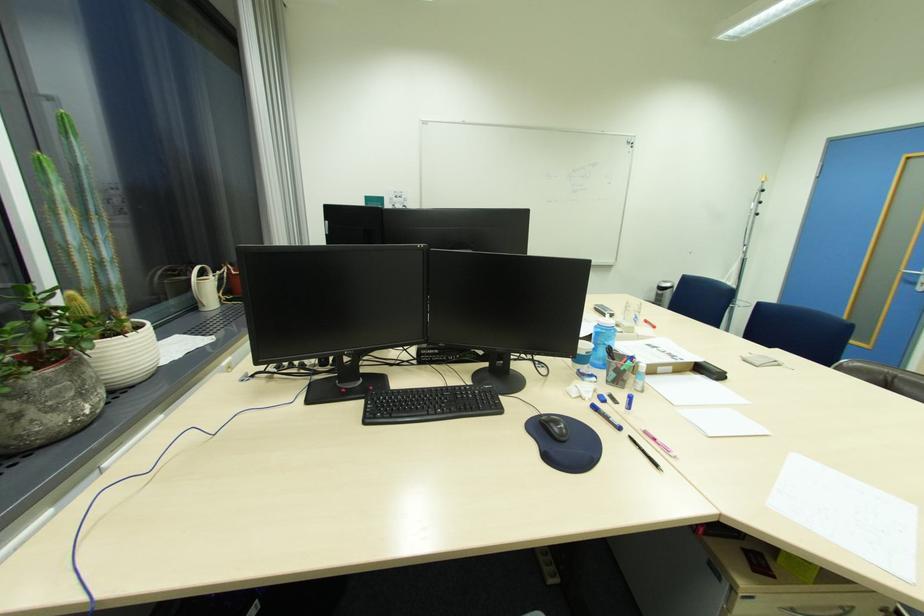
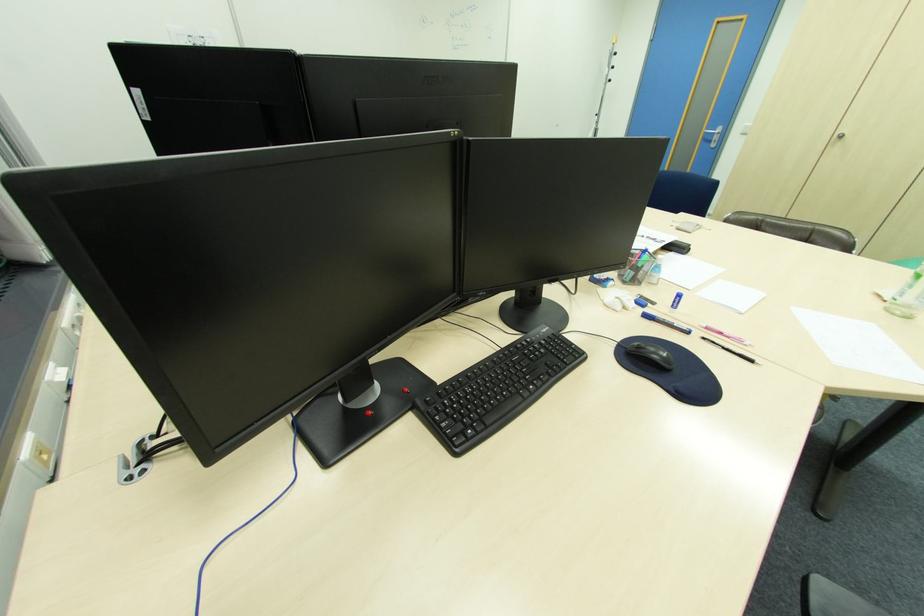
Locate, in the second image, the point that corresponds to point 600,408 in the first image.

(651, 315)